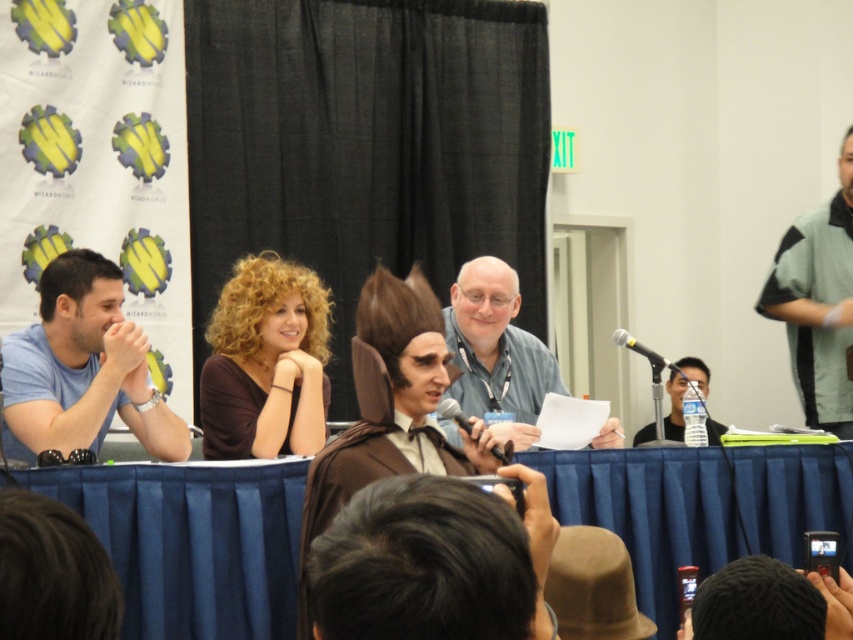
Who is positioned more to the left, blue fabric table at center or black metallic microphone at right?

black metallic microphone at right is more to the left.

Is point (206, 525) positioned after point (640, 352)?

No, (206, 525) is in front of (640, 352).

Locate an element on the screen. This screenshot has width=853, height=640. blue fabric table at center is located at coordinates (193, 541).

Between green fabric shirt at right and clear plastic water bottle at center, which one has less height?

clear plastic water bottle at center is shorter.

Is green fabric shirt at right bigger than clear plastic water bottle at center?

Actually, green fabric shirt at right might be smaller than clear plastic water bottle at center.

Describe the element at coordinates (817, 304) in the screenshot. I see `green fabric shirt at right` at that location.

Locate an element on the screen. The width and height of the screenshot is (853, 640). green fabric shirt at right is located at coordinates (817, 304).

Who is taller, blue cotton shirt at left or black matte microphone at center?

Standing taller between the two is blue cotton shirt at left.

Does blue cotton shirt at left have a greater width compared to black matte microphone at center?

Indeed, blue cotton shirt at left has a greater width compared to black matte microphone at center.

Is point (90, 346) closer to viewer compared to point (463, 419)?

No, it is not.

Locate an element on the screen. This screenshot has width=853, height=640. blue cotton shirt at left is located at coordinates point(82,369).